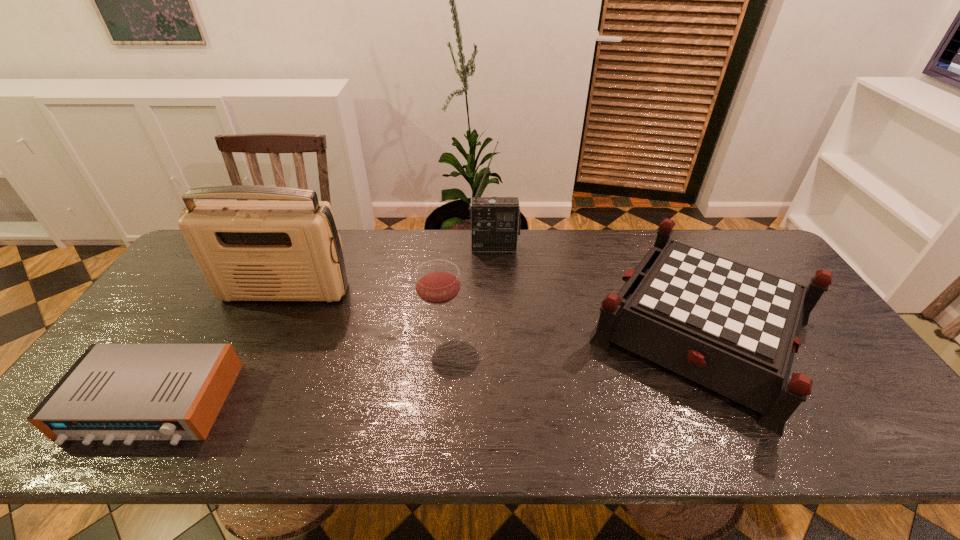
Find the location of a particular element. Image resolution: width=960 pixels, height=540 pixels. the second object from right to left is located at coordinates (495, 221).

Locate an element on the screen. This screenshot has height=540, width=960. the farthest object is located at coordinates (495, 221).

Find the location of a particular element. the second farthest radio receiver is located at coordinates (290, 250).

Where is `wineglass`? The height and width of the screenshot is (540, 960). wineglass is located at coordinates (437, 283).

Image resolution: width=960 pixels, height=540 pixels. Find the location of `the third object from right to left`. the third object from right to left is located at coordinates (437, 283).

Where is `checkerboard`? This screenshot has width=960, height=540. checkerboard is located at coordinates (734, 329).

At what (x,y) coordinates should I click in order to perform the action: click on the fourth tallest object. Please return your answer as a coordinate pair (x, y). The width and height of the screenshot is (960, 540). Looking at the image, I should click on (734, 329).

Identify the location of the shortest radio receiver. This screenshot has width=960, height=540. (128, 392).

At what (x,y) coordinates should I click in order to perform the action: click on the nearest radio receiver. Please return your answer as a coordinate pair (x, y). The image size is (960, 540). Looking at the image, I should click on (128, 392).

I want to click on free region located 0.380m on the display of the second object from right to left, so click(498, 340).